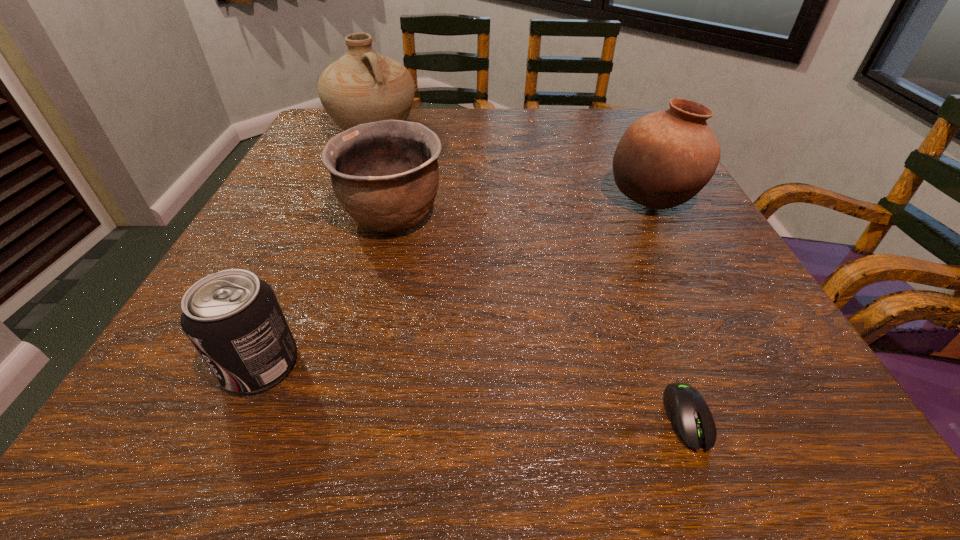
The height and width of the screenshot is (540, 960). What are the coordinates of `vacant space at the near edge of the desktop` in the screenshot? It's located at pyautogui.click(x=584, y=397).

Identify the location of vacant space at the left edge of the desktop. (202, 359).

In the image, there is a desktop. Identify the location of free space at the right edge. The height and width of the screenshot is (540, 960). (745, 336).

In the image, there is a desktop. At what (x,y) coordinates should I click in order to perform the action: click on vacant space at the near left corner. Please return your answer as a coordinate pair (x, y). The image size is (960, 540). Looking at the image, I should click on (137, 392).

The height and width of the screenshot is (540, 960). In the image, there is a desktop. What are the coordinates of `vacant space at the far right corner` in the screenshot? It's located at (596, 111).

Image resolution: width=960 pixels, height=540 pixels. Identify the location of free spot at the near right corner of the desktop. (820, 416).

Identify the location of blank region between the farthest object and the rightmost pottery. (513, 165).

I want to click on vacant space that is in between the soda can and the farthest object, so click(317, 247).

Locate an element on the screen. Image resolution: width=960 pixels, height=540 pixels. empty space between the farthest pottery and the rightmost pottery is located at coordinates (513, 165).

Locate an element on the screen. vacant space that's between the shortest pottery and the rightmost pottery is located at coordinates (522, 208).